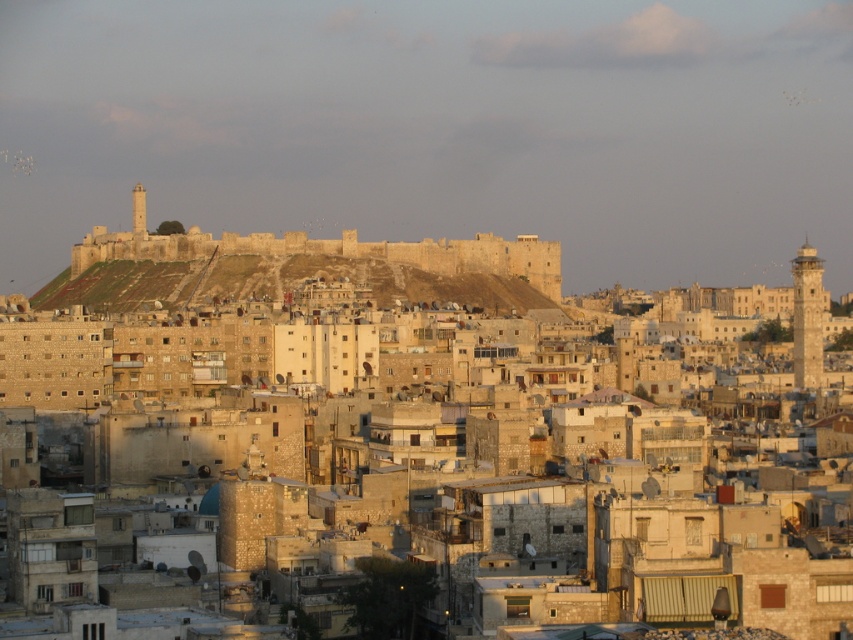
Question: Among these objects, which one is nearest to the camera?

Choices:
 (A) stone fortress at center
 (B) beige stone buildings at center

Answer: (B)

Question: Is beige stone buildings at center bigger than stone fortress at center?

Choices:
 (A) no
 (B) yes

Answer: (B)

Question: Can you confirm if beige stone buildings at center is positioned to the right of stone fortress at center?

Choices:
 (A) yes
 (B) no

Answer: (A)

Question: Which object appears farthest from the camera in this image?

Choices:
 (A) stone fortress at center
 (B) beige stone buildings at center

Answer: (A)

Question: Does beige stone buildings at center appear on the left side of stone fortress at center?

Choices:
 (A) no
 (B) yes

Answer: (A)